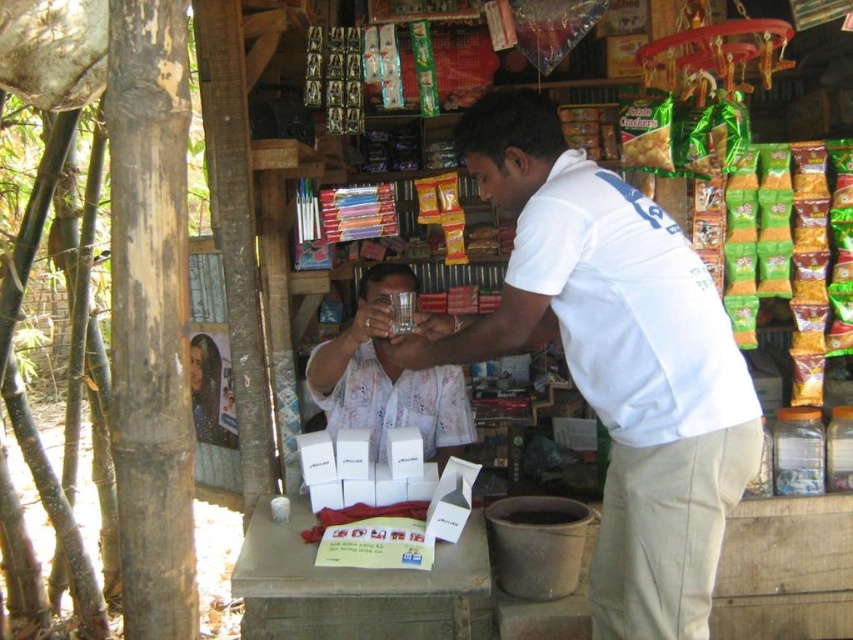
You are a customer in the shop and want to place the white cotton shirt at center and the white matte glass at center on a shelf. Since the shelf has limited space, which item should you place first to ensure both fit?

The white cotton shirt at center is larger than the white matte glass at center. To ensure both fit on the shelf, place the larger item first, so place the white cotton shirt at center first.